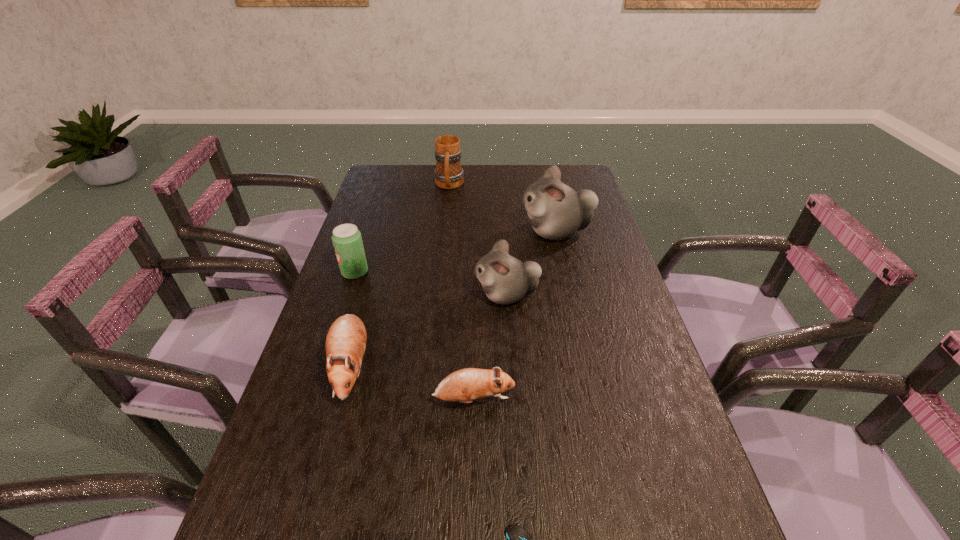
Where is `free point between the tallest object and the right brown hamster`? This screenshot has width=960, height=540. free point between the tallest object and the right brown hamster is located at coordinates (515, 316).

Choose which object is the nearest neighbor to the smaller brown hamster. Please provide its 2D coordinates. Your answer should be formatted as a tuple, i.e. [(x, y)], where the tuple contains the x and y coordinates of a point satisfying the conditions above.

[(345, 345)]

Where is `the second closest object relative to the farthest object`? The height and width of the screenshot is (540, 960). the second closest object relative to the farthest object is located at coordinates (347, 240).

Find the location of a particular element. This screenshot has width=960, height=540. hamster identified as the second closest to the bigger white hamster is located at coordinates [x=345, y=345].

Select which hamster appears as the third closest to the farthest object. Please provide its 2D coordinates. Your answer should be formatted as a tuple, i.e. [(x, y)], where the tuple contains the x and y coordinates of a point satisfying the conditions above.

[(345, 345)]

Locate an element on the screen. The height and width of the screenshot is (540, 960). free space that satisfies the following two spatial constraints: 1. on the face of the tallest object; 2. at the face of the left brown hamster is located at coordinates (586, 367).